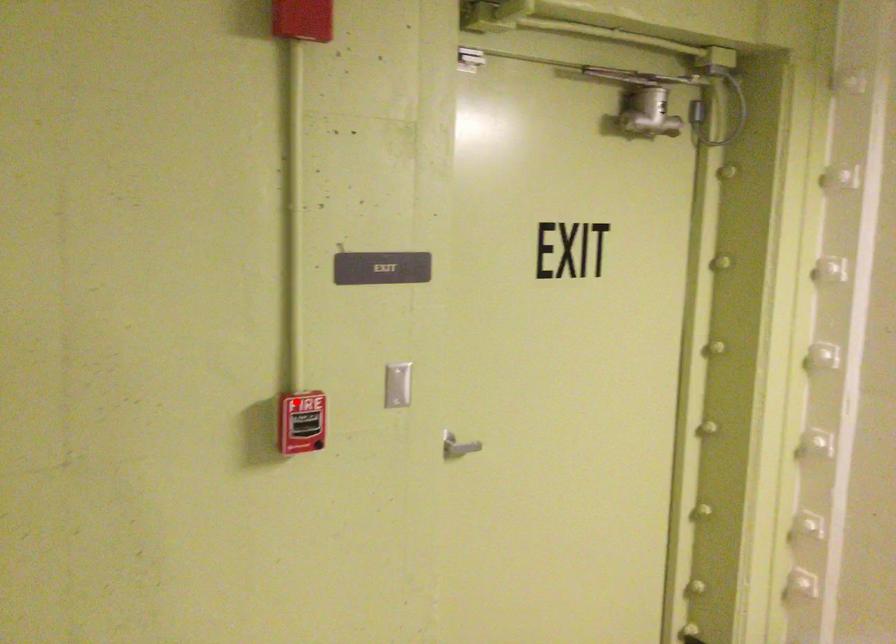
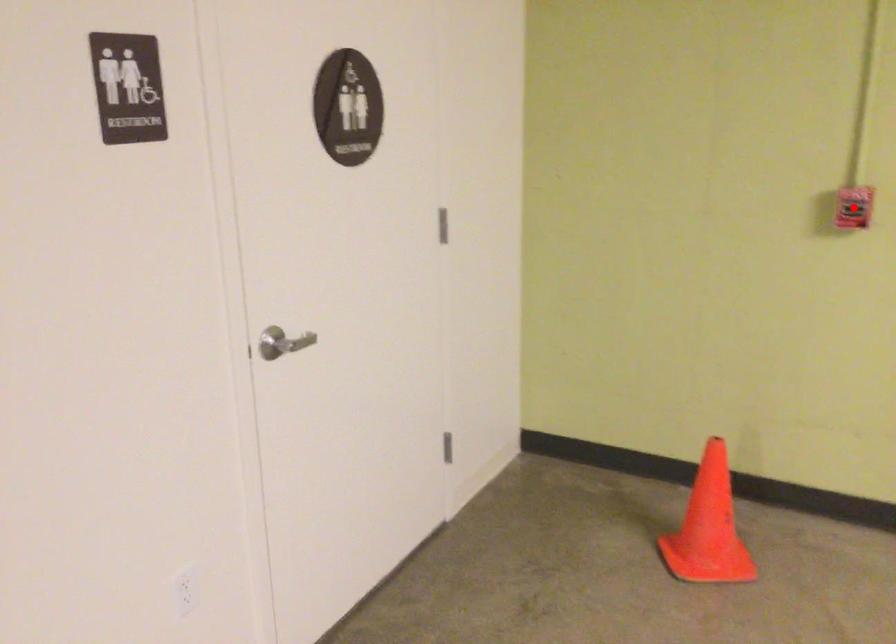
I am providing you with two images of the same scene from different viewpoints. A red point is marked on the first image and another point is marked on the second image. Is the red point in image1 aligned with the point shown in image2?

Yes